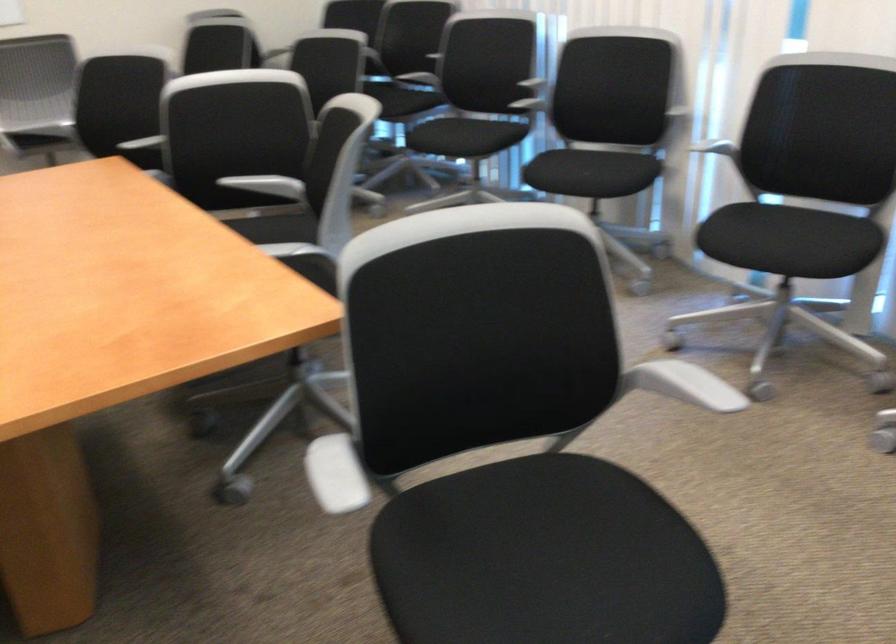
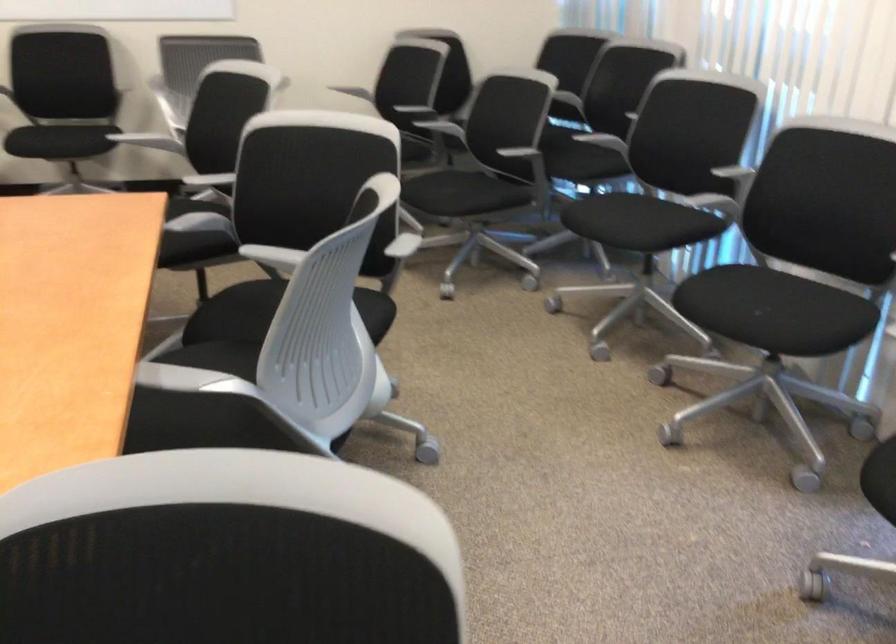
Where in the second image is the point corresponding to (x=250, y=185) from the first image?

(273, 258)